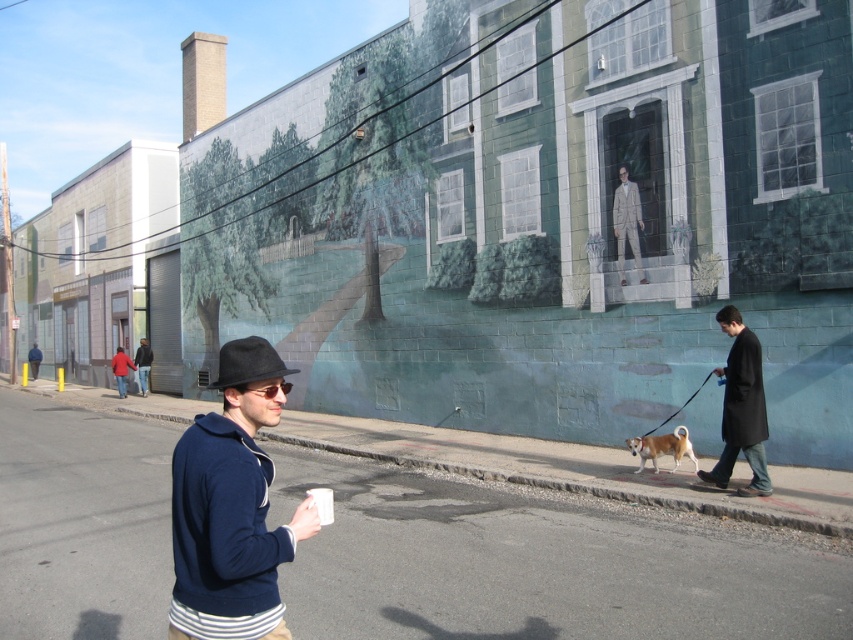
Question: Which point is farther to the camera?

Choices:
 (A) black wool coat at right
 (B) dark blue sweater at center

Answer: (B)

Question: Among these objects, which one is farthest from the camera?

Choices:
 (A) light beige suit at center
 (B) black wool coat at right
 (C) light brown fur at center

Answer: (A)

Question: From the image, what is the correct spatial relationship of black wool coat at right in relation to light beige suit at center?

Choices:
 (A) right
 (B) left

Answer: (A)

Question: Which point appears closest to the camera in this image?

Choices:
 (A) (142, 371)
 (B) (613, 230)
 (C) (744, 333)

Answer: (C)

Question: Can you confirm if black wool coat at right is positioned above light beige suit at center?

Choices:
 (A) no
 (B) yes

Answer: (A)

Question: Does smooth asphalt road at lower center come in front of matte black hat at center?

Choices:
 (A) no
 (B) yes

Answer: (A)